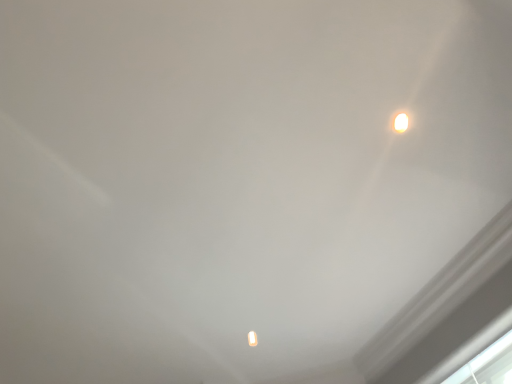
Where is `white glossy lamp at upper right`? The image size is (512, 384). white glossy lamp at upper right is located at coordinates (401, 122).

In order to face white glossy lamp at upper right, should I rotate leftwards or rightwards?

Turn right by 18.757 degrees to look at white glossy lamp at upper right.

Describe the element at coordinates (401, 122) in the screenshot. I see `white glossy lamp at upper right` at that location.

Image resolution: width=512 pixels, height=384 pixels. What do you see at coordinates (487, 365) in the screenshot?
I see `transparent glass window at lower right` at bounding box center [487, 365].

Where is `transparent glass window at lower right`? The image size is (512, 384). transparent glass window at lower right is located at coordinates (487, 365).

Locate an element on the screen. Image resolution: width=512 pixels, height=384 pixels. white glossy lamp at upper right is located at coordinates (401, 122).

Which object is positioned more to the right, transparent glass window at lower right or white glossy lamp at upper right?

From the viewer's perspective, transparent glass window at lower right appears more on the right side.

From the picture: Which object is closer to the camera taking this photo, transparent glass window at lower right or white glossy lamp at upper right?

white glossy lamp at upper right is more forward.

Which is in front, point (503, 380) or point (403, 122)?

The point (403, 122) is more forward.

From the image's perspective, which is above, transparent glass window at lower right or white glossy lamp at upper right?

white glossy lamp at upper right, from the image's perspective.

Based on the photo, from a real-world perspective, who is located lower, transparent glass window at lower right or white glossy lamp at upper right?

transparent glass window at lower right, from a real-world perspective.

In terms of width, does transparent glass window at lower right look wider or thinner when compared to white glossy lamp at upper right?

Considering their sizes, transparent glass window at lower right looks broader than white glossy lamp at upper right.

Between transparent glass window at lower right and white glossy lamp at upper right, which one has more height?

With more height is transparent glass window at lower right.

Does transparent glass window at lower right have a smaller size compared to white glossy lamp at upper right?

No.

Is transparent glass window at lower right not within white glossy lamp at upper right?

Yes.

Is transparent glass window at lower right not near white glossy lamp at upper right?

Yes, transparent glass window at lower right and white glossy lamp at upper right are located far from each other.

Is transparent glass window at lower right oriented towards white glossy lamp at upper right?

No, transparent glass window at lower right is not facing towards white glossy lamp at upper right.

This screenshot has height=384, width=512. In order to click on lamp on the left of the transparent glass window at lower right in this screenshot , I will do `click(401, 122)`.

Between white glossy lamp at upper right and transparent glass window at lower right, which one appears on the left side from the viewer's perspective?

From the viewer's perspective, white glossy lamp at upper right appears more on the left side.

Is white glossy lamp at upper right behind transparent glass window at lower right?

No, it is in front of transparent glass window at lower right.

Considering the points (396, 130) and (487, 372), which point is in front, point (396, 130) or point (487, 372)?

Positioned in front is point (396, 130).

From the image's perspective, which one is positioned lower, white glossy lamp at upper right or transparent glass window at lower right?

transparent glass window at lower right is shown below in the image.

From a real-world perspective, which is physically below, white glossy lamp at upper right or transparent glass window at lower right?

transparent glass window at lower right, from a real-world perspective.

Can you confirm if white glossy lamp at upper right is thinner than transparent glass window at lower right?

Yes.

In terms of height, does white glossy lamp at upper right look taller or shorter compared to transparent glass window at lower right?

Clearly, white glossy lamp at upper right is shorter compared to transparent glass window at lower right.

Consider the image. Considering the relative sizes of white glossy lamp at upper right and transparent glass window at lower right in the image provided, is white glossy lamp at upper right bigger than transparent glass window at lower right?

No.

Do you think white glossy lamp at upper right is within transparent glass window at lower right, or outside of it?

white glossy lamp at upper right is spatially situated outside transparent glass window at lower right.

Is there a large distance between white glossy lamp at upper right and transparent glass window at lower right?

white glossy lamp at upper right is far away from transparent glass window at lower right.

Is white glossy lamp at upper right positioned with its back to transparent glass window at lower right?

No, white glossy lamp at upper right is not facing away from transparent glass window at lower right.

How many degrees apart are the facing directions of white glossy lamp at upper right and transparent glass window at lower right?

2.08 degrees.

Find the location of `lamp above the transparent glass window at lower right (from a real-world perspective)`. lamp above the transparent glass window at lower right (from a real-world perspective) is located at coordinates (401, 122).

Where is `lamp that is above the transparent glass window at lower right (from a real-world perspective)`? Image resolution: width=512 pixels, height=384 pixels. lamp that is above the transparent glass window at lower right (from a real-world perspective) is located at coordinates (401, 122).

The image size is (512, 384). In order to click on window located underneath the white glossy lamp at upper right (from a real-world perspective) in this screenshot , I will do `click(487, 365)`.